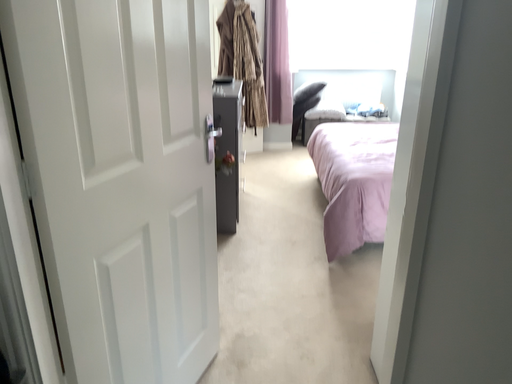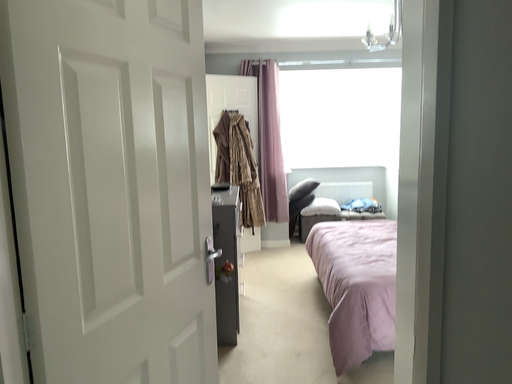
Question: Which way did the camera rotate in the video?

Choices:
 (A) rotated upward
 (B) rotated downward

Answer: (A)